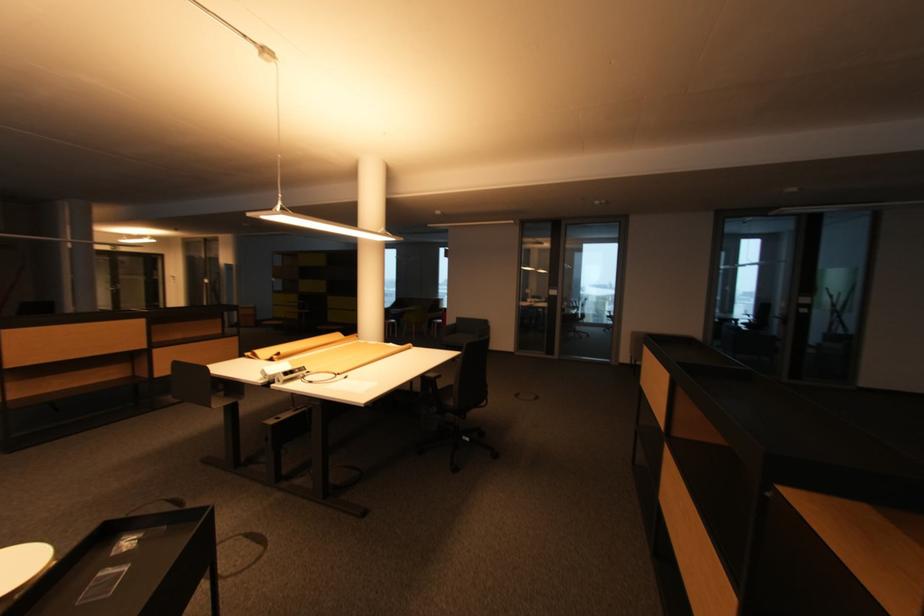
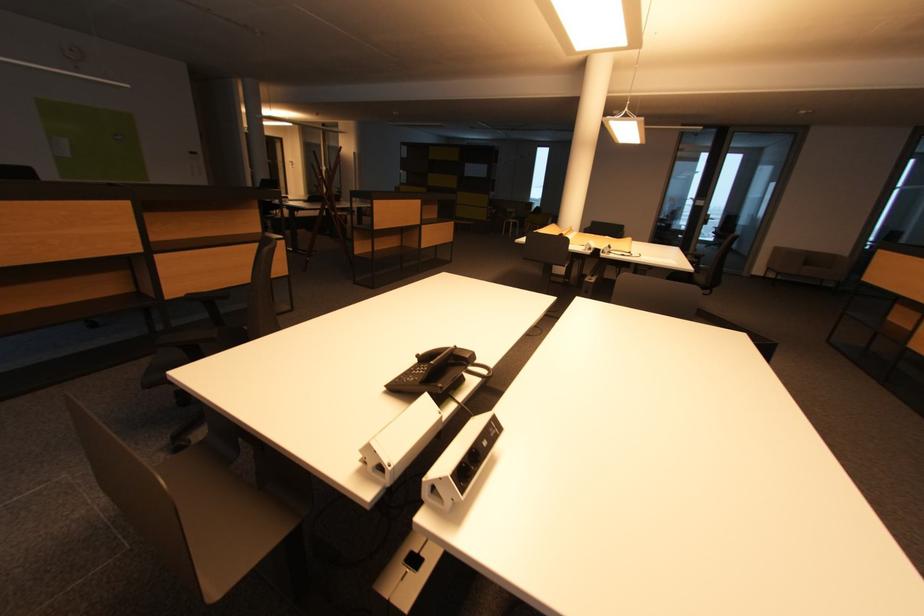
The images are taken continuously from a first-person perspective. In which direction are you moving?

The movement direction of the cameraman is left, backward.